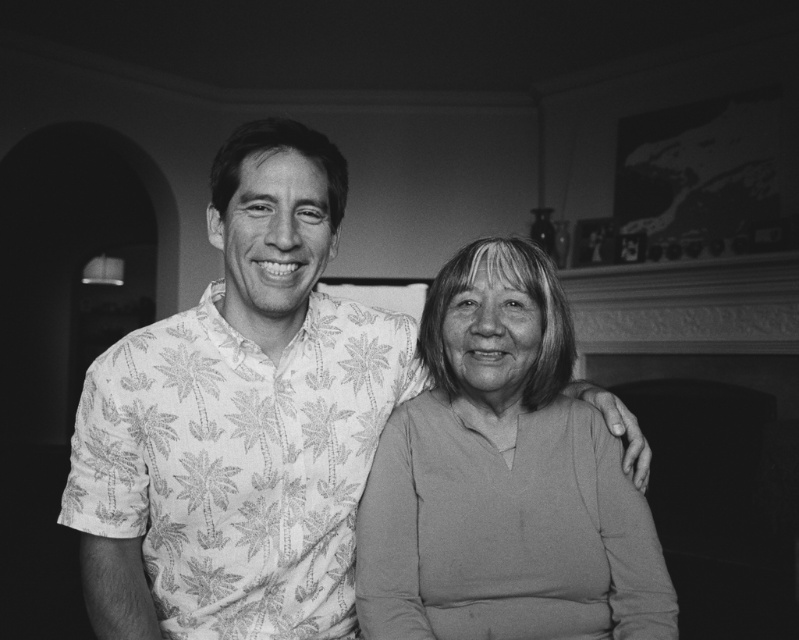
You are an interior designer planning to place a new decorative item at point (239,420). What object is already located there?

The palm print shirt at left is located at point (239,420).

You are standing in the room where the two people are sitting. If you want to move from the point marked by coordinates point (173, 520) to the point marked by coordinates point (499, 401), which direction should you move?

You should move backward because point (173, 520) is in front of point (499, 401).

You are an interior designer analyzing the photograph. You need to locate the palm print shirt at left in the image. Where exactly is it positioned?

The palm print shirt at left is located at point 0.659 on the x axis and 0.300 on the y axis.